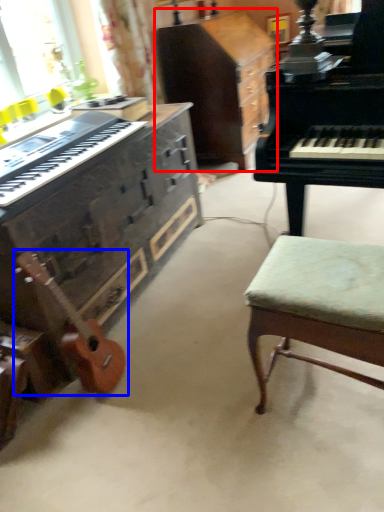
Question: Which of the following is the farthest to the observer, cabinetry (highlighted by a red box) or guitar (highlighted by a blue box)?

Choices:
 (A) cabinetry
 (B) guitar

Answer: (A)